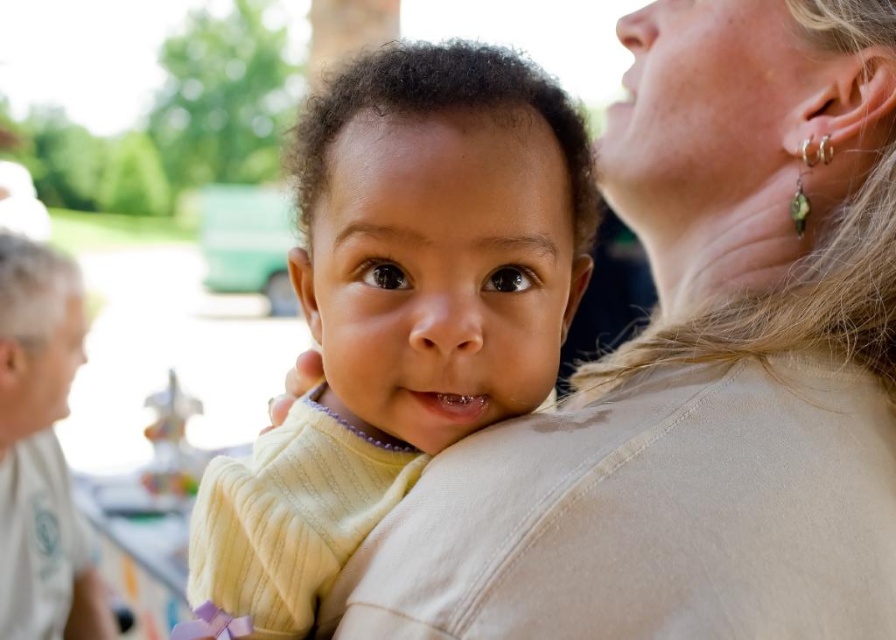
You are a photographer adjusting your camera to focus on two specific points in the image. The first point is at coordinates point (631, 541) and the second is at point (367, 467). Which point should you focus on first if you want to capture the subject closest to the camera?

Point (631, 541) is in front of point (367, 467), so you should focus on point (631, 541) first as it is closer to the camera.

You are a photographer trying to capture the baby in the center of the frame. There is a smooth beige sweater at upper right in the image. Where should you adjust your camera to focus on the baby while avoiding the sweater?

The smooth beige sweater at upper right is located at point (696, 371), so you should adjust your camera to focus on the baby by moving the focus point away from the coordinates (696, 371) to center the baby.

You are a fashion designer observing the image and need to decide which sweater to recommend for a client who prefers a more oversized style. Which sweater between the smooth beige sweater at upper right and the soft yellow sweater at center should you suggest?

The smooth beige sweater at upper right has a larger size compared to the soft yellow sweater at center, so it is more oversized and would be the better recommendation for the client.